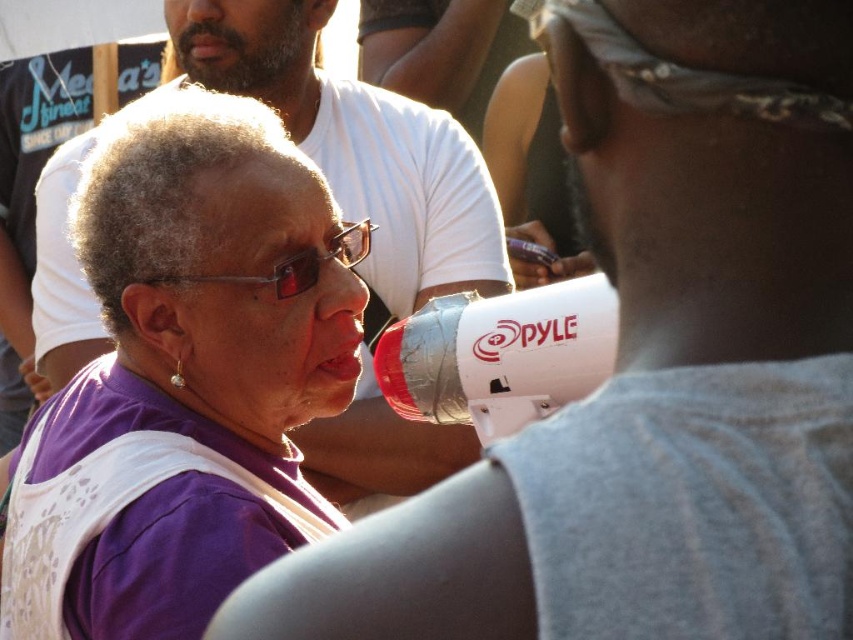
What do you see at coordinates (357, 147) in the screenshot?
I see `white matte megaphone at center` at bounding box center [357, 147].

Between point (309, 74) and point (305, 184), which one is positioned behind?

Positioned behind is point (309, 74).

At what (x,y) coordinates should I click in order to perform the action: click on white matte megaphone at center. Please return your answer as a coordinate pair (x, y). Looking at the image, I should click on (357, 147).

Looking at this image, does sunglasses at center have a lesser width compared to bearded man at upper left?

Incorrect, sunglasses at center's width is not less than bearded man at upper left's.

Which is behind, point (228, 280) or point (171, 74)?

The point (171, 74) is more distant.

Find the location of a particular element. The height and width of the screenshot is (640, 853). sunglasses at center is located at coordinates (296, 262).

Can you confirm if purple fabric at center is smaller than sunglasses at center?

Actually, purple fabric at center might be larger than sunglasses at center.

You are a GUI agent. You are given a task and a screenshot of the screen. Output one action in this format:
    pyautogui.click(x=<x>, y=<y>)
    Task: Click on the purple fabric at center
    The image size is (853, 640).
    Given the screenshot: What is the action you would take?
    pyautogui.click(x=184, y=376)